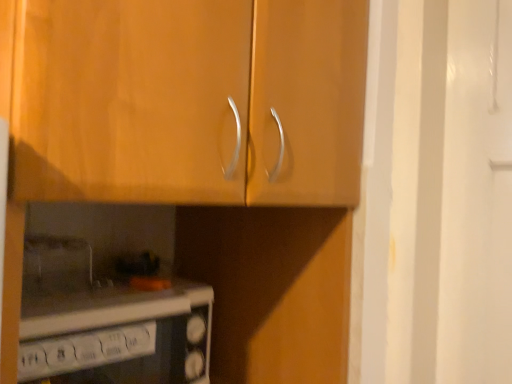
Locate an element on the screen. The width and height of the screenshot is (512, 384). vacant point above white glossy microwave at lower left (from a real-world perspective) is located at coordinates (104, 298).